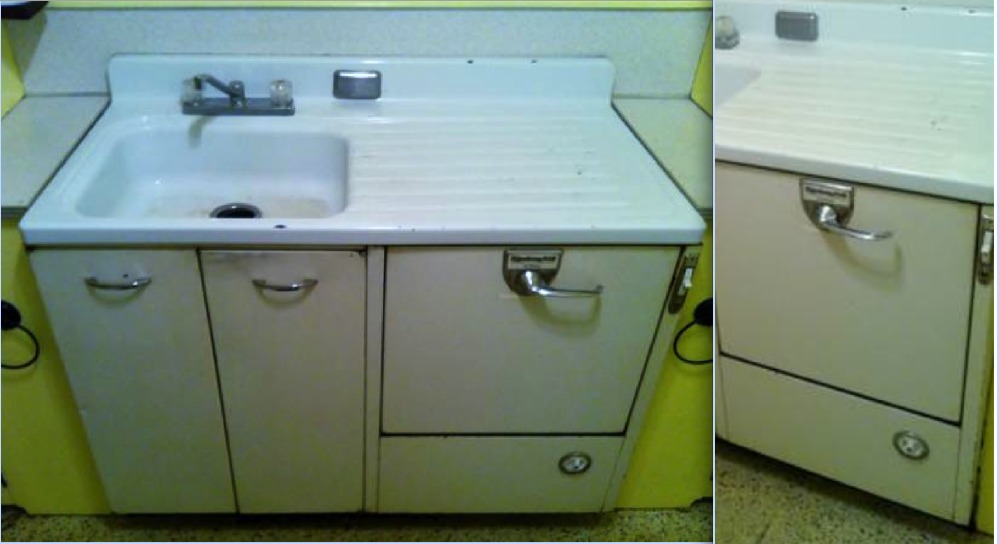
The height and width of the screenshot is (544, 999). What are the coordinates of `drain` in the screenshot? It's located at (226, 209).